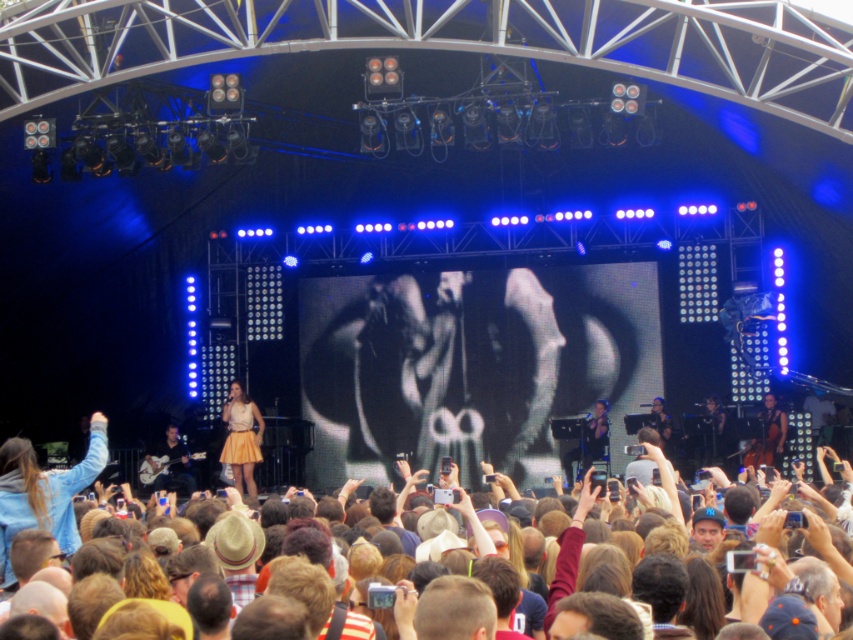
Is brown hair at center to the right of yellow textured skirt at center from the viewer's perspective?

Correct, you'll find brown hair at center to the right of yellow textured skirt at center.

In the scene shown: Who is positioned more to the left, brown hair at center or yellow textured skirt at center?

Positioned to the left is yellow textured skirt at center.

At what (x,y) coordinates should I click in order to perform the action: click on brown hair at center. Please return your answer as a coordinate pair (x, y). Image resolution: width=853 pixels, height=640 pixels. Looking at the image, I should click on [157, 625].

What are the coordinates of `brown hair at center` in the screenshot? It's located at 157,625.

Does yellow textured skirt at center have a lesser height compared to dark blue fabric at center?

No, yellow textured skirt at center is not shorter than dark blue fabric at center.

Does point (239, 387) come closer to viewer compared to point (662, 435)?

No, (239, 387) is behind (662, 435).

Locate an element on the screen. yellow textured skirt at center is located at coordinates (241, 436).

Is the position of matte black guitar at lower left more distant than that of dark blue fabric at center?

Yes, matte black guitar at lower left is behind dark blue fabric at center.

Who is taller, matte black guitar at lower left or dark blue fabric at center?

With more height is dark blue fabric at center.

Is point (181, 445) in front of point (657, 417)?

No, (181, 445) is behind (657, 417).

This screenshot has width=853, height=640. What are the coordinates of `matte black guitar at lower left` in the screenshot? It's located at (171, 464).